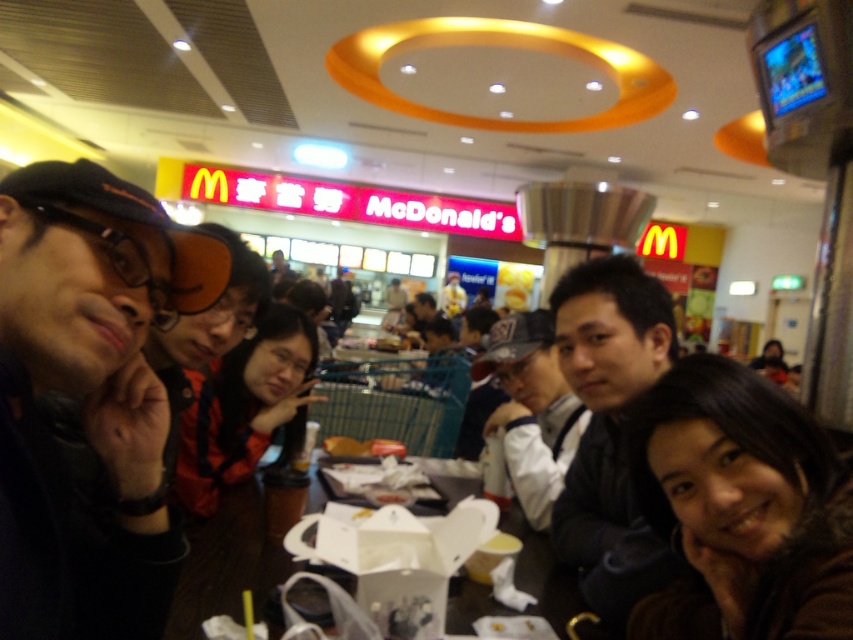
Between point (553, 618) and point (486, 452), which one is positioned behind?

Positioned behind is point (486, 452).

Looking at this image, which is more to the left, wooden table at center or matte black cap at center?

wooden table at center

Is point (561, 628) farther from camera compared to point (538, 397)?

No, (561, 628) is closer to viewer.

In order to click on wooden table at center in this screenshot , I will do `click(227, 563)`.

From the picture: Which is below, black matte cap at upper left or wooden table at center?

wooden table at center is lower down.

Locate an element on the screen. black matte cap at upper left is located at coordinates (86, 396).

Who is more forward, (20, 632) or (257, 516)?

Point (20, 632) is more forward.

The image size is (853, 640). I want to click on black matte cap at upper left, so click(x=86, y=396).

Who is more forward, (x=581, y=308) or (x=567, y=589)?

Positioned in front is point (x=581, y=308).

Which is below, black matte jacket at center or wooden table at center?

Positioned lower is wooden table at center.

The height and width of the screenshot is (640, 853). Describe the element at coordinates (608, 428) in the screenshot. I see `black matte jacket at center` at that location.

Identify the location of black matte jacket at center. Image resolution: width=853 pixels, height=640 pixels. (608, 428).